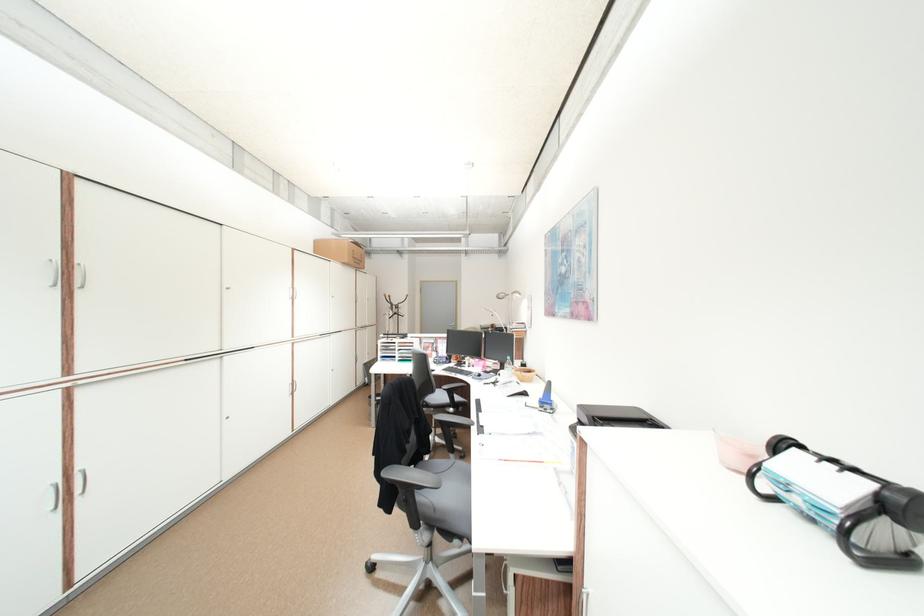
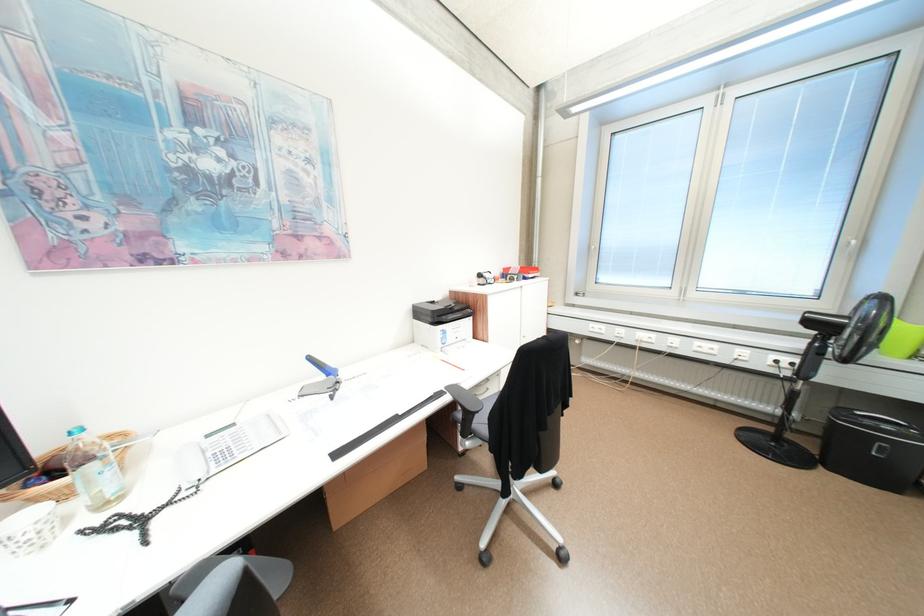
The point at (558, 384) is marked in the first image. Where is the corresponding point in the second image?

(320, 359)